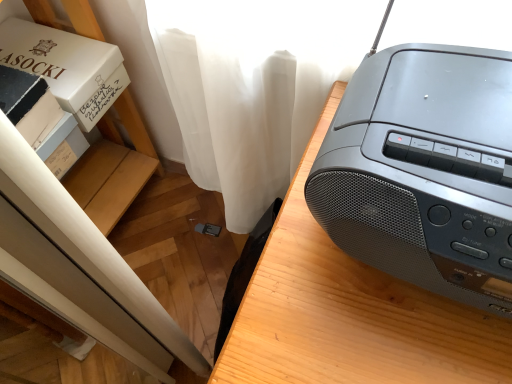
Identify the location of white cardboard box at upper left. (114, 167).

Where is `white cardboard box at left`? white cardboard box at left is located at coordinates (40, 118).

The image size is (512, 384). Describe the element at coordinates (350, 313) in the screenshot. I see `matte black boombox at right` at that location.

From the picture: Measure the distance between matte black boombox at right and camera.

They are 13.82 inches apart.

Image resolution: width=512 pixels, height=384 pixels. What do you see at coordinates (424, 171) in the screenshot?
I see `matte black radio at upper right` at bounding box center [424, 171].

Where is `white cardboard box at upper left`? The width and height of the screenshot is (512, 384). white cardboard box at upper left is located at coordinates (67, 67).

This screenshot has height=384, width=512. Find the location of `white cardboard box at upper left`. white cardboard box at upper left is located at coordinates (114, 167).

Can you tell me how much white cardboard box at left and matte black radio at upper right differ in facing direction?

The angular difference between white cardboard box at left and matte black radio at upper right is 85.9 degrees.

Considering the relative positions of white cardboard box at left and matte black radio at upper right in the image provided, is white cardboard box at left to the right of matte black radio at upper right from the viewer's perspective?

In fact, white cardboard box at left is to the left of matte black radio at upper right.

Which object is further away from the camera, white cardboard box at left or matte black radio at upper right?

white cardboard box at left is further from the camera.

Does white cardboard box at left have a greater height compared to matte black radio at upper right?

No.

Could you tell me if white cardboard box at upper left is turned towards matte black boombox at right?

Yes, white cardboard box at upper left faces towards matte black boombox at right.

In the scene shown: From a real-world perspective, is white cardboard box at upper left on top of matte black boombox at right?

Yes, from a real-world perspective, white cardboard box at upper left is above matte black boombox at right.

Considering the relative positions of white cardboard box at upper left and matte black boombox at right in the image provided, is white cardboard box at upper left to the left of matte black boombox at right from the viewer's perspective?

Correct, you'll find white cardboard box at upper left to the left of matte black boombox at right.

Between matte black radio at upper right and white cardboard box at upper left, which one is positioned behind?

white cardboard box at upper left is behind.

From a real-world perspective, is matte black radio at upper right beneath white cardboard box at upper left?

Actually, matte black radio at upper right is physically above white cardboard box at upper left in the real world.

Is matte black radio at upper right completely or partially outside of white cardboard box at upper left?

matte black radio at upper right is positioned outside white cardboard box at upper left.

Is matte black radio at upper right facing away from white cardboard box at upper left?

That's not correct — matte black radio at upper right is not looking away from white cardboard box at upper left.

Which is behind, point (248, 378) or point (50, 76)?

The point (50, 76) is behind.

From a real-world perspective, which is physically below, matte black boombox at right or white cardboard box at upper left?

In real-world perspective, matte black boombox at right is lower.

In the scene shown: Which is correct: matte black boombox at right is inside white cardboard box at upper left, or outside of it?

matte black boombox at right is not enclosed by white cardboard box at upper left.

Looking at this image, between white cardboard box at upper left and matte black radio at upper right, which one has larger size?

Bigger between the two is white cardboard box at upper left.

Locate an element on the screen. The width and height of the screenshot is (512, 384). shelf below the matte black radio at upper right (from a real-world perspective) is located at coordinates (114, 167).

Is point (115, 131) positioned behind point (362, 107)?

Yes, it is behind point (362, 107).

Is matte black boombox at right closer to camera compared to matte black radio at upper right?

Yes, the depth of matte black boombox at right is less than that of matte black radio at upper right.

Considering the relative sizes of matte black boombox at right and matte black radio at upper right in the image provided, is matte black boombox at right bigger than matte black radio at upper right?

Indeed, matte black boombox at right has a larger size compared to matte black radio at upper right.

From a real-world perspective, is matte black boombox at right located beneath matte black radio at upper right?

Correct, in the physical world, matte black boombox at right is lower than matte black radio at upper right.

From the image's perspective, which object appears higher, white cardboard box at upper left or white cardboard box at upper left?

white cardboard box at upper left is shown above in the image.

Which object is positioned more to the right, white cardboard box at upper left or white cardboard box at upper left?

white cardboard box at upper left is more to the right.

Is white cardboard box at upper left facing away from white cardboard box at upper left?

Correct, white cardboard box at upper left is looking away from white cardboard box at upper left.

The image size is (512, 384). Identify the location of printer on the right of white cardboard box at left. (424, 171).

Image resolution: width=512 pixels, height=384 pixels. In order to click on shelf to the left of matte black boombox at right in this screenshot , I will do `click(114, 167)`.

Estimate the real-world distances between objects in this image. Which object is closer to matte black boombox at right, white cardboard box at upper left or white cardboard box at upper left?

white cardboard box at upper left.

Based on their spatial positions, is white cardboard box at left or matte black radio at upper right closer to white cardboard box at upper left?

The object closer to white cardboard box at upper left is white cardboard box at left.

From the image, which object appears to be farther from white cardboard box at upper left, matte black boombox at right or white cardboard box at upper left?

Based on the image, matte black boombox at right appears to be further to white cardboard box at upper left.

Looking at the image, which one is located closer to white cardboard box at left, matte black radio at upper right or white cardboard box at upper left?

Based on the image, white cardboard box at upper left appears to be nearer to white cardboard box at left.

Which object lies further to the anchor point white cardboard box at left, matte black radio at upper right or white cardboard box at upper left?

The object further to white cardboard box at left is matte black radio at upper right.

When comparing their distances from matte black boombox at right, does white cardboard box at left or white cardboard box at upper left seem closer?

white cardboard box at left.

Based on their spatial positions, is white cardboard box at upper left or matte black boombox at right closer to white cardboard box at left?

white cardboard box at upper left is closer to white cardboard box at left.

Considering their positions, is matte black boombox at right positioned closer to matte black radio at upper right than white cardboard box at left?

matte black boombox at right lies closer to matte black radio at upper right than the other object.

The height and width of the screenshot is (384, 512). In order to click on box between white cardboard box at upper left and white cardboard box at upper left in the front-back direction in this screenshot , I will do `click(40, 118)`.

Image resolution: width=512 pixels, height=384 pixels. Find the location of `printer between white cardboard box at upper left and matte black boombox at right`. printer between white cardboard box at upper left and matte black boombox at right is located at coordinates (424, 171).

This screenshot has width=512, height=384. I want to click on shelf between white cardboard box at left and matte black radio at upper right from left to right, so (114, 167).

Where is `paperback book between white cardboard box at left and matte black radio at upper right from left to right`? Image resolution: width=512 pixels, height=384 pixels. paperback book between white cardboard box at left and matte black radio at upper right from left to right is located at coordinates (67, 67).